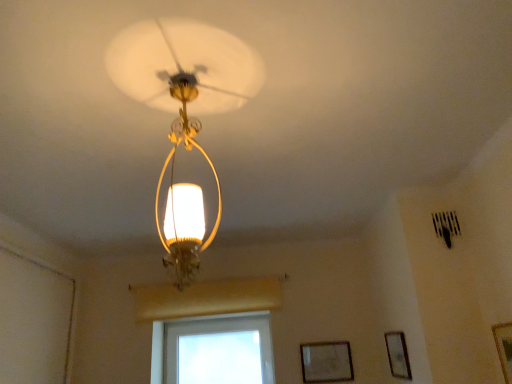
This screenshot has height=384, width=512. Describe the element at coordinates (398, 355) in the screenshot. I see `wooden picture frame at lower right, the 2th picture frame viewed from the back` at that location.

In the scene shown: Measure the distance between point (500, 337) and camera.

The depth of point (500, 337) is 1.74 meters.

Locate an element on the screen. The height and width of the screenshot is (384, 512). wooden picture frame at lower right, the second picture frame in the right-to-left sequence is located at coordinates (398, 355).

From the picture: Is matte gold chandelier at center wider or thinner than wooden picture frame at lower right, the 3th picture frame positioned from the back?

Considering their sizes, matte gold chandelier at center looks broader than wooden picture frame at lower right, the 3th picture frame positioned from the back.

Looking at this image, is matte gold chandelier at center positioned far away from wooden picture frame at lower right, marked as the 1th picture frame in a right-to-left arrangement?

Yes, matte gold chandelier at center and wooden picture frame at lower right, marked as the 1th picture frame in a right-to-left arrangement, are quite far apart.

Is wooden picture frame at lower right, the 3th picture frame positioned from the back, inside matte gold chandelier at center?

That's incorrect, wooden picture frame at lower right, the 3th picture frame positioned from the back, is not inside matte gold chandelier at center.

From a real-world perspective, relative to wooden picture frame at lower right, the 3th picture frame positioned from the back, is matte gold chandelier at center vertically above or below?

matte gold chandelier at center is situated higher than wooden picture frame at lower right, the 3th picture frame positioned from the back, in the real world.

Which point is more forward, [205,338] or [196,185]?

Positioned in front is point [196,185].

Are transparent glass window at center and matte gold chandelier at center located far from each other?

transparent glass window at center is positioned a significant distance from matte gold chandelier at center.

Is transparent glass window at center further to the viewer compared to matte gold chandelier at center?

Yes, it is behind matte gold chandelier at center.

Could matte gold chandelier at center be considered to be inside transparent glass window at center?

Actually, matte gold chandelier at center is outside transparent glass window at center.

Is wooden picture frame at lower right, the second picture frame in the right-to-left sequence, wider or thinner than wooden framed picture at lower right, which appears as the 1th picture frame when viewed from the left?

Considering their sizes, wooden picture frame at lower right, the second picture frame in the right-to-left sequence, looks broader than wooden framed picture at lower right, which appears as the 1th picture frame when viewed from the left.

Considering the relative sizes of wooden picture frame at lower right, arranged as the 2th picture frame when viewed from the front, and wooden framed picture at lower right, which appears as the 1th picture frame when viewed from the left, in the image provided, is wooden picture frame at lower right, arranged as the 2th picture frame when viewed from the front, taller than wooden framed picture at lower right, which appears as the 1th picture frame when viewed from the left,?

Correct, wooden picture frame at lower right, arranged as the 2th picture frame when viewed from the front, is much taller as wooden framed picture at lower right, which appears as the 1th picture frame when viewed from the left.

Can you confirm if wooden picture frame at lower right, the 2th picture frame viewed from the back, is positioned to the left of wooden framed picture at lower right, which appears as the 1th picture frame when viewed from the left?

No.

Is wooden picture frame at lower right, positioned as the second picture frame in left-to-right order, beside wooden framed picture at lower right, placed as the third picture frame when sorted from right to left?

wooden picture frame at lower right, positioned as the second picture frame in left-to-right order, and wooden framed picture at lower right, placed as the third picture frame when sorted from right to left, are not in contact.

Can you confirm if matte gold chandelier at center is positioned to the left of transparent glass window at center?

In fact, matte gold chandelier at center is to the right of transparent glass window at center.

Is matte gold chandelier at center positioned with its back to transparent glass window at center?

No.

Locate an element on the screen. light fixture lying above the transparent glass window at center (from the image's perspective) is located at coordinates (185, 194).

Between matte gold chandelier at center and transparent glass window at center, which one has smaller width?

With smaller width is transparent glass window at center.

Looking at their sizes, would you say matte gold chandelier at center is wider or thinner than wooden framed picture at lower right, placed as the third picture frame when sorted from right to left?

matte gold chandelier at center is wider than wooden framed picture at lower right, placed as the third picture frame when sorted from right to left.

Considering their positions, is matte gold chandelier at center located in front of or behind wooden framed picture at lower right, placed as the third picture frame when sorted from right to left?

matte gold chandelier at center is in front of wooden framed picture at lower right, placed as the third picture frame when sorted from right to left.

Consider the image. In terms of size, does wooden framed picture at lower right, the 3th picture frame in the front-to-back sequence, appear bigger or smaller than transparent glass window at center?

Clearly, wooden framed picture at lower right, the 3th picture frame in the front-to-back sequence, is smaller in size than transparent glass window at center.

Which object is positioned more to the right, wooden framed picture at lower right, positioned as the 1th picture frame in back-to-front order, or transparent glass window at center?

wooden framed picture at lower right, positioned as the 1th picture frame in back-to-front order, is more to the right.

Is wooden framed picture at lower right, placed as the third picture frame when sorted from right to left, inside the boundaries of transparent glass window at center, or outside?

wooden framed picture at lower right, placed as the third picture frame when sorted from right to left, is not inside transparent glass window at center, it's outside.

Considering the relative sizes of wooden framed picture at lower right, the 3th picture frame in the front-to-back sequence, and wooden picture frame at lower right, the 2th picture frame viewed from the back, in the image provided, is wooden framed picture at lower right, the 3th picture frame in the front-to-back sequence, wider than wooden picture frame at lower right, the 2th picture frame viewed from the back,?

No, wooden framed picture at lower right, the 3th picture frame in the front-to-back sequence, is not wider than wooden picture frame at lower right, the 2th picture frame viewed from the back.

Is wooden framed picture at lower right, placed as the third picture frame when sorted from right to left, at the right side of wooden picture frame at lower right, positioned as the second picture frame in left-to-right order?

In fact, wooden framed picture at lower right, placed as the third picture frame when sorted from right to left, is to the left of wooden picture frame at lower right, positioned as the second picture frame in left-to-right order.

Can you confirm if wooden framed picture at lower right, which appears as the 1th picture frame when viewed from the left, is bigger than wooden picture frame at lower right, positioned as the second picture frame in left-to-right order?

Incorrect, wooden framed picture at lower right, which appears as the 1th picture frame when viewed from the left, is not larger than wooden picture frame at lower right, positioned as the second picture frame in left-to-right order.

The width and height of the screenshot is (512, 384). What are the coordinates of `light fixture lying on the left of wooden picture frame at lower right, the first picture frame in the front-to-back sequence` in the screenshot? It's located at (185, 194).

The image size is (512, 384). I want to click on window that appears below the matte gold chandelier at center (from the image's perspective), so click(213, 350).

Considering their positions, is wooden framed picture at lower right, positioned as the 1th picture frame in back-to-front order, positioned closer to wooden picture frame at lower right, the first picture frame in the front-to-back sequence, than matte gold chandelier at center?

wooden framed picture at lower right, positioned as the 1th picture frame in back-to-front order, lies closer to wooden picture frame at lower right, the first picture frame in the front-to-back sequence, than the other object.

Based on their spatial positions, is matte gold chandelier at center or wooden picture frame at lower right, marked as the 1th picture frame in a right-to-left arrangement, further from wooden picture frame at lower right, positioned as the second picture frame in left-to-right order?

matte gold chandelier at center is positioned further to the anchor wooden picture frame at lower right, positioned as the second picture frame in left-to-right order.

When comparing their distances from transparent glass window at center, does wooden picture frame at lower right, the first picture frame in the front-to-back sequence, or wooden framed picture at lower right, the 3th picture frame in the front-to-back sequence, seem closer?

wooden framed picture at lower right, the 3th picture frame in the front-to-back sequence, is closer to transparent glass window at center.

When comparing their distances from wooden picture frame at lower right, positioned as the second picture frame in left-to-right order, does wooden framed picture at lower right, positioned as the 1th picture frame in back-to-front order, or wooden picture frame at lower right, marked as the 1th picture frame in a right-to-left arrangement, seem further?

wooden picture frame at lower right, marked as the 1th picture frame in a right-to-left arrangement.

Based on their spatial positions, is wooden framed picture at lower right, the 3th picture frame in the front-to-back sequence, or wooden picture frame at lower right, the 2th picture frame viewed from the back, further from wooden picture frame at lower right, arranged as the third picture frame when viewed from the left?

wooden framed picture at lower right, the 3th picture frame in the front-to-back sequence, is positioned further to the anchor wooden picture frame at lower right, arranged as the third picture frame when viewed from the left.

In the scene shown: When comparing their distances from wooden framed picture at lower right, positioned as the 1th picture frame in back-to-front order, does wooden picture frame at lower right, the first picture frame in the front-to-back sequence, or wooden picture frame at lower right, arranged as the 2th picture frame when viewed from the front, seem further?

wooden picture frame at lower right, the first picture frame in the front-to-back sequence, is further to wooden framed picture at lower right, positioned as the 1th picture frame in back-to-front order.

Based on their spatial positions, is matte gold chandelier at center or wooden framed picture at lower right, positioned as the 1th picture frame in back-to-front order, further from wooden picture frame at lower right, the 2th picture frame viewed from the back?

Among the two, matte gold chandelier at center is located further to wooden picture frame at lower right, the 2th picture frame viewed from the back.

Estimate the real-world distances between objects in this image. Which object is further from wooden framed picture at lower right, positioned as the 1th picture frame in back-to-front order, wooden picture frame at lower right, arranged as the 2th picture frame when viewed from the front, or matte gold chandelier at center?

matte gold chandelier at center.

You are a GUI agent. You are given a task and a screenshot of the screen. Output one action in this format:
    pyautogui.click(x=<x>, y=<y>)
    Task: Click on the picture frame located between transparent glass window at center and wooden picture frame at lower right, the 2th picture frame viewed from the back, in the left-right direction
    The image size is (512, 384).
    Given the screenshot: What is the action you would take?
    pyautogui.click(x=326, y=362)

Where is `picture frame between wooden picture frame at lower right, marked as the 1th picture frame in a right-to-left arrangement, and wooden framed picture at lower right, placed as the third picture frame when sorted from right to left, along the z-axis`? picture frame between wooden picture frame at lower right, marked as the 1th picture frame in a right-to-left arrangement, and wooden framed picture at lower right, placed as the third picture frame when sorted from right to left, along the z-axis is located at coordinates (398, 355).